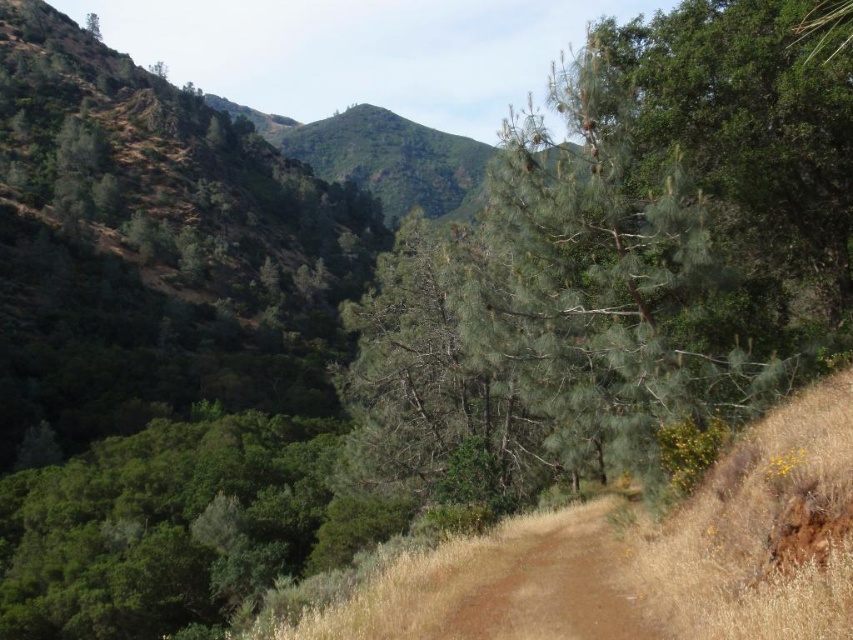
Question: Can you confirm if green needle-like at center is positioned to the right of brown dirt track at center?

Choices:
 (A) no
 (B) yes

Answer: (B)

Question: Where is green needle-like at center located in relation to brown dirt track at center in the image?

Choices:
 (A) above
 (B) below

Answer: (A)

Question: Is green needle-like at center smaller than brown dirt track at center?

Choices:
 (A) no
 (B) yes

Answer: (A)

Question: Among these points, which one is nearest to the camera?

Choices:
 (A) (666, 413)
 (B) (473, 579)

Answer: (A)

Question: Which point is closer to the camera taking this photo?

Choices:
 (A) (534, 556)
 (B) (550, 214)

Answer: (B)

Question: Which object appears farthest from the camera in this image?

Choices:
 (A) brown dirt track at center
 (B) green needle-like at center

Answer: (A)